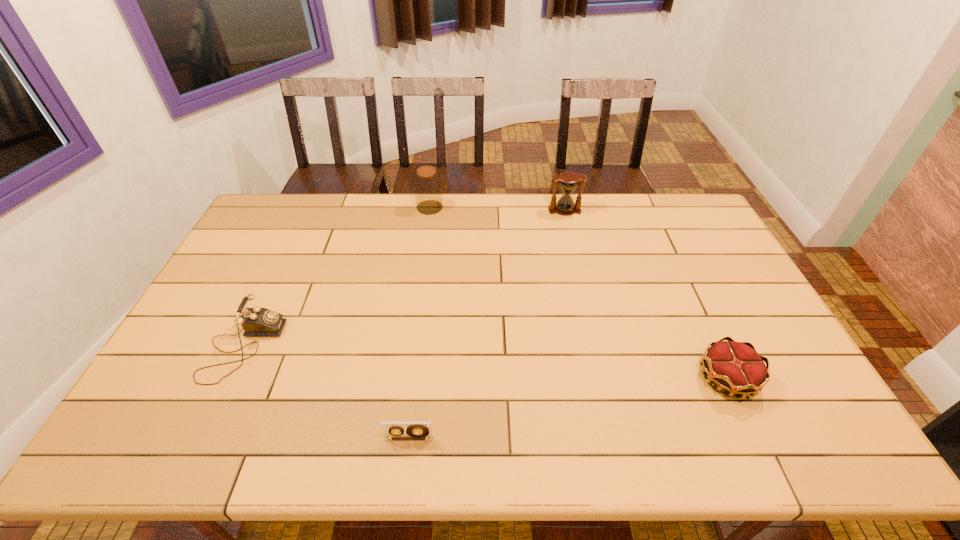
Locate an element on the screen. jar is located at coordinates pyautogui.click(x=427, y=184).

Where is `the second object from right to left`? Image resolution: width=960 pixels, height=540 pixels. the second object from right to left is located at coordinates (569, 181).

This screenshot has width=960, height=540. I want to click on the leftmost object, so click(256, 321).

Find the location of a particular element. Image resolution: width=960 pixels, height=540 pixels. telephone is located at coordinates (256, 321).

You are a GUI agent. You are given a task and a screenshot of the screen. Output one action in this format:
    pyautogui.click(x=<x>, y=<y>)
    Task: Click on the rightmost object
    Image resolution: width=960 pixels, height=540 pixels.
    Given the screenshot: What is the action you would take?
    pyautogui.click(x=736, y=367)

Image resolution: width=960 pixels, height=540 pixels. What are the coordinates of `the shortest object` in the screenshot? It's located at (415, 430).

Identify the location of videotape. The width and height of the screenshot is (960, 540). (415, 430).

Locate an element on the screen. The width and height of the screenshot is (960, 540). vacant space located 0.310m on the front of the jar is located at coordinates (420, 272).

Where is `free space located 0.400m on the front of the second object from right to left`? free space located 0.400m on the front of the second object from right to left is located at coordinates (584, 294).

Identify the location of free space located 0.060m on the dial of the leftmost object. The height and width of the screenshot is (540, 960). (299, 348).